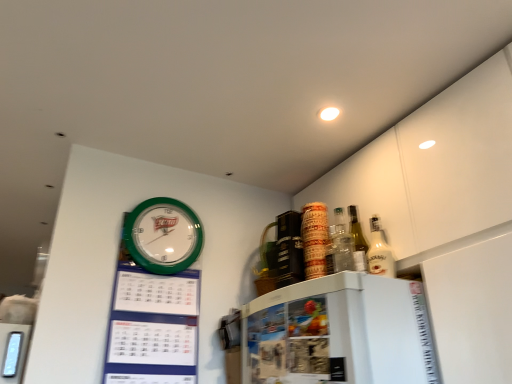
Question: From the image's perspective, would you say green plastic wall clock at upper left is shown under green plastic calendar at upper left?

Choices:
 (A) yes
 (B) no

Answer: (B)

Question: From a real-world perspective, is green plastic wall clock at upper left positioned under green plastic calendar at upper left based on gravity?

Choices:
 (A) yes
 (B) no

Answer: (B)

Question: Is green plastic wall clock at upper left far from green plastic calendar at upper left?

Choices:
 (A) no
 (B) yes

Answer: (A)

Question: Can you confirm if green plastic wall clock at upper left is wider than green plastic calendar at upper left?

Choices:
 (A) yes
 (B) no

Answer: (B)

Question: Does green plastic wall clock at upper left have a lesser width compared to green plastic calendar at upper left?

Choices:
 (A) yes
 (B) no

Answer: (A)

Question: Considering the relative positions of green plastic wall clock at upper left and green plastic calendar at upper left in the image provided, is green plastic wall clock at upper left to the left or to the right of green plastic calendar at upper left?

Choices:
 (A) right
 (B) left

Answer: (B)

Question: Is point (144, 200) positioned closer to the camera than point (159, 283)?

Choices:
 (A) closer
 (B) farther

Answer: (B)

Question: Based on their sizes in the image, would you say green plastic wall clock at upper left is bigger or smaller than green plastic calendar at upper left?

Choices:
 (A) small
 (B) big

Answer: (A)

Question: From their relative heights in the image, would you say green plastic wall clock at upper left is taller or shorter than green plastic calendar at upper left?

Choices:
 (A) short
 (B) tall

Answer: (A)

Question: From the image's perspective, is green plastic calendar at upper left located above or below green plastic wall clock at upper left?

Choices:
 (A) below
 (B) above

Answer: (A)

Question: Is green plastic calendar at upper left wider or thinner than green plastic wall clock at upper left?

Choices:
 (A) thin
 (B) wide

Answer: (B)

Question: Considering the positions of green plastic calendar at upper left and green plastic wall clock at upper left in the image, is green plastic calendar at upper left taller or shorter than green plastic wall clock at upper left?

Choices:
 (A) short
 (B) tall

Answer: (B)

Question: From a real-world perspective, relative to green plastic wall clock at upper left, is green plastic calendar at upper left vertically above or below?

Choices:
 (A) below
 (B) above

Answer: (A)

Question: In terms of height, does green plastic calendar at upper left look taller or shorter compared to white glossy bottle at upper right?

Choices:
 (A) short
 (B) tall

Answer: (B)

Question: In terms of size, does green plastic calendar at upper left appear bigger or smaller than white glossy bottle at upper right?

Choices:
 (A) small
 (B) big

Answer: (B)